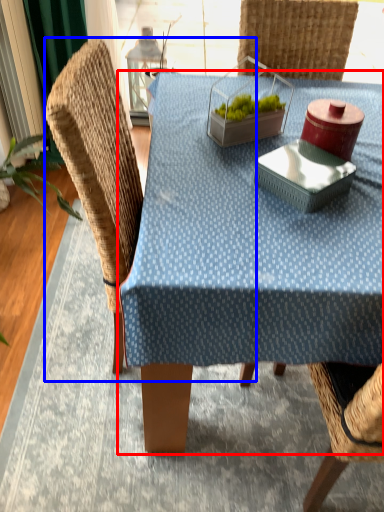
Question: Which of the following is the closest to the observer, table (highlighted by a red box) or swivel chair (highlighted by a blue box)?

Choices:
 (A) table
 (B) swivel chair

Answer: (A)